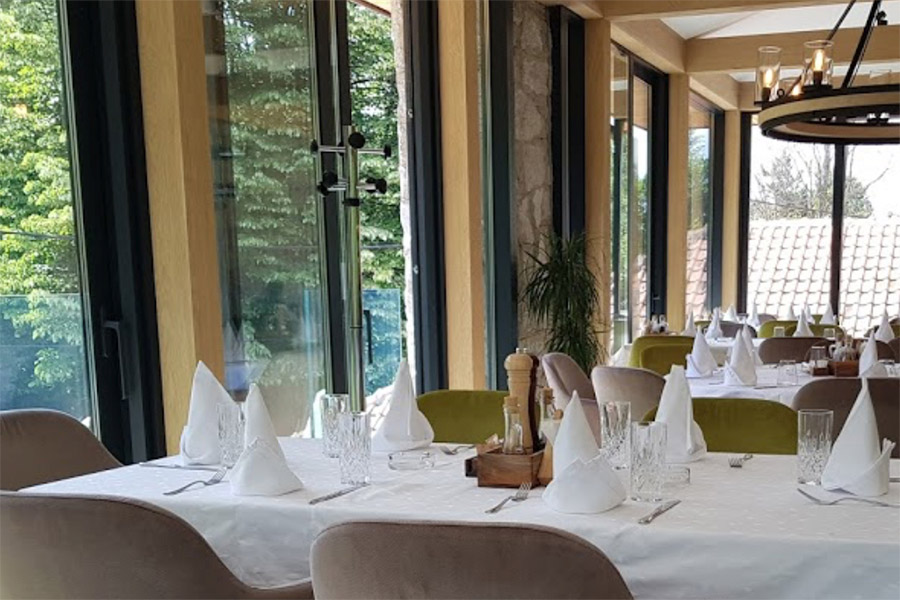
The width and height of the screenshot is (900, 600). What are the coordinates of `green chairs` in the screenshot? It's located at (748, 420), (477, 412), (663, 360), (646, 339), (771, 322), (817, 328), (703, 320), (816, 316).